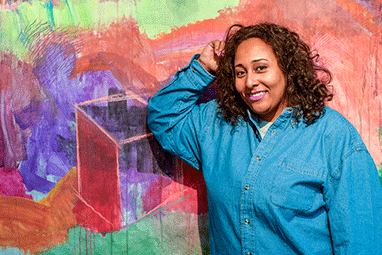
Image resolution: width=382 pixels, height=255 pixels. Identify the location of painted wall. (126, 63).